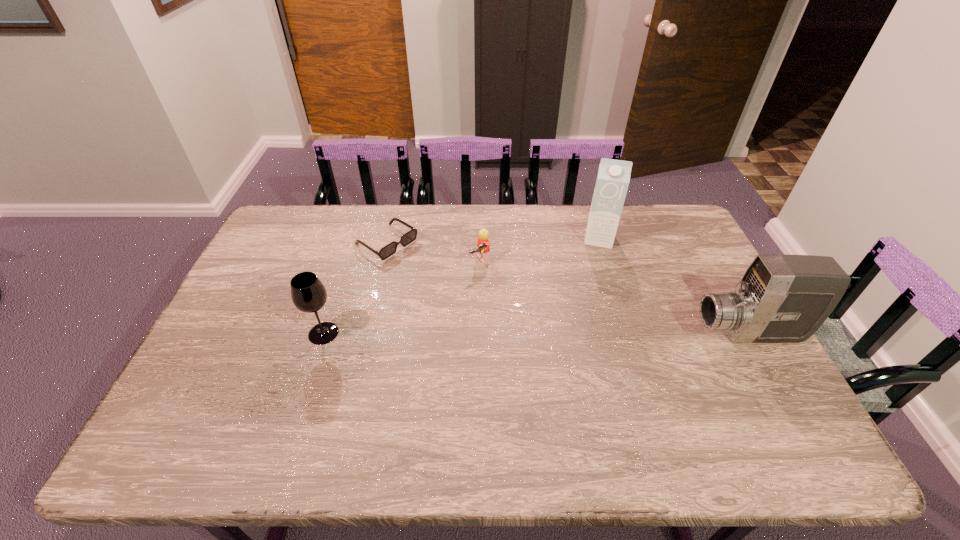
The image size is (960, 540). In order to click on object that can be found as the second closest to the camcorder in this screenshot , I will do `click(483, 244)`.

This screenshot has height=540, width=960. I want to click on object that is the fourth closest to the fourth object from left to right, so click(309, 295).

Where is `vacant space that satisfies the following two spatial constraints: 1. on the front side of the rightmost object; 2. at the front of the fourth object from left to right, highlighting the lens`? The width and height of the screenshot is (960, 540). vacant space that satisfies the following two spatial constraints: 1. on the front side of the rightmost object; 2. at the front of the fourth object from left to right, highlighting the lens is located at coordinates (628, 334).

The height and width of the screenshot is (540, 960). I want to click on free spot that satisfies the following two spatial constraints: 1. on the front side of the fourth shortest object; 2. at the front of the second object from right to left, highlighting the lens, so click(x=628, y=334).